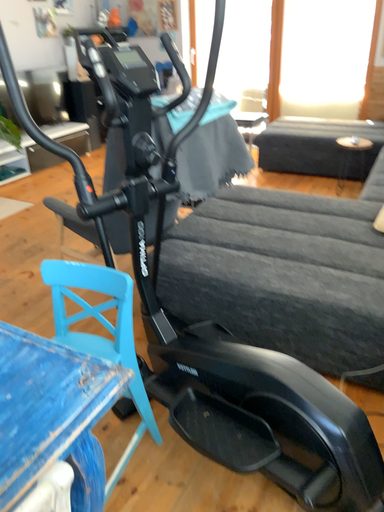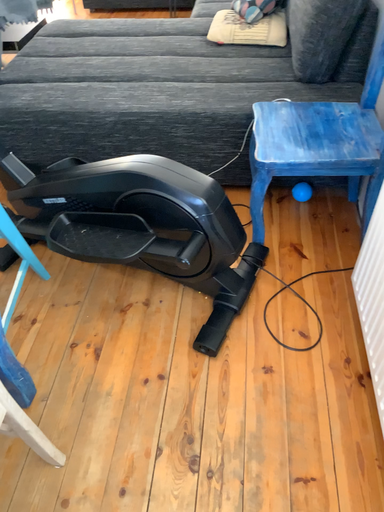
Question: How did the camera likely rotate when shooting the video?

Choices:
 (A) rotated upward
 (B) rotated downward

Answer: (B)